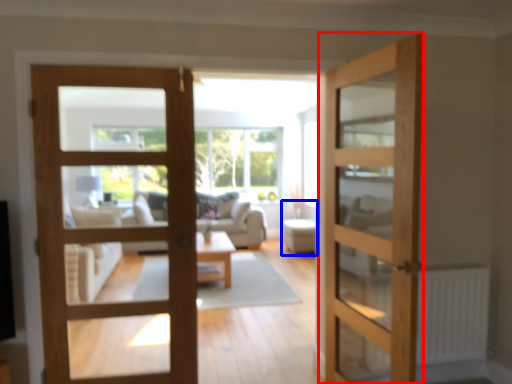
Question: Which point is further to the camera, door (highlighted by a red box) or furniture (highlighted by a blue box)?

Choices:
 (A) door
 (B) furniture

Answer: (B)